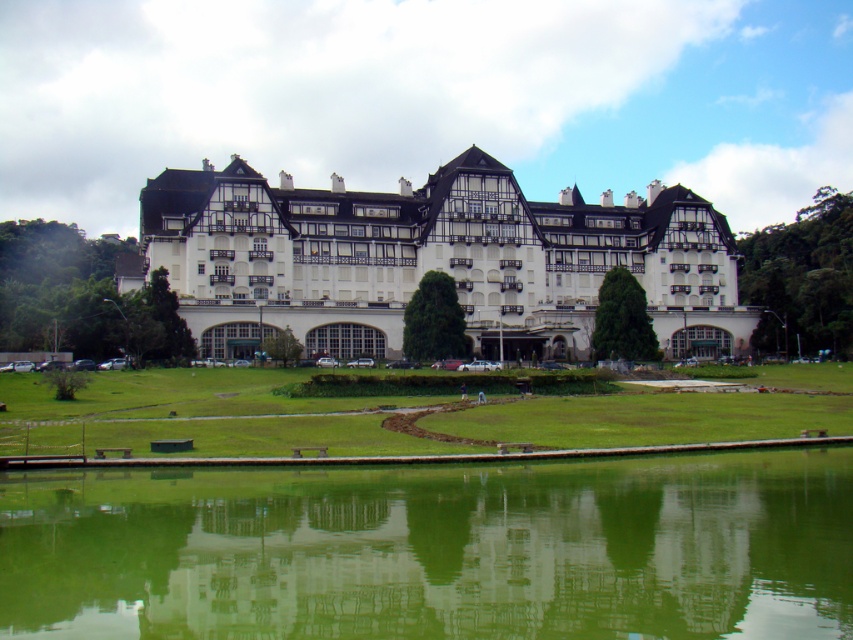
You are standing on the paved pathway leading to the grand building and want to reach the green reflective water at center. Which direction should you move relative to the building?

The green reflective water at center is located at coordinates point (x=434, y=550), so you should move towards the center area in front of the building to reach it.